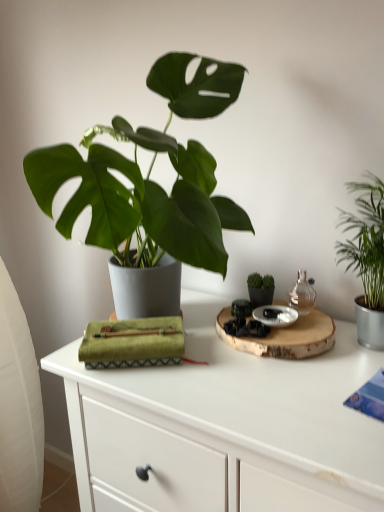
Locate an element on the screen. Image resolution: width=384 pixels, height=512 pixels. free space in front of green leafy plant at right is located at coordinates (337, 386).